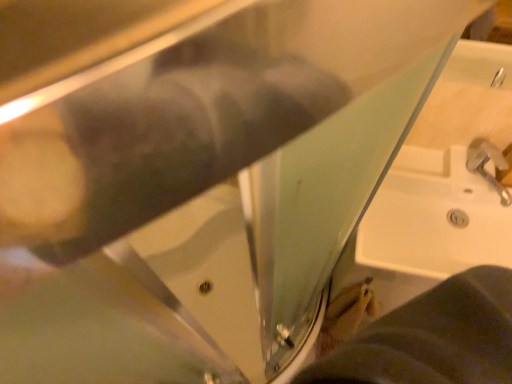
The image size is (512, 384). What do you see at coordinates (487, 171) in the screenshot?
I see `silver metallic faucet at lower right` at bounding box center [487, 171].

Identify the location of silver metallic faucet at lower right. The height and width of the screenshot is (384, 512). (487, 171).

Locate an element on the screen. silver metallic faucet at lower right is located at coordinates (487, 171).